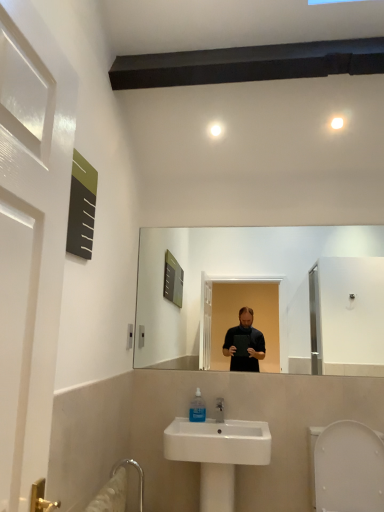
Question: Should I look upward or downward to see white plastic bidet at lower right?

Choices:
 (A) up
 (B) down

Answer: (B)

Question: Is white plastic bidet at lower right touching white ceramic sink at lower center?

Choices:
 (A) yes
 (B) no

Answer: (B)

Question: Is white plastic bidet at lower right at the left side of white ceramic sink at lower center?

Choices:
 (A) yes
 (B) no

Answer: (B)

Question: Is white plastic bidet at lower right not inside white ceramic sink at lower center?

Choices:
 (A) no
 (B) yes

Answer: (B)

Question: Considering the relative sizes of white plastic bidet at lower right and white ceramic sink at lower center in the image provided, is white plastic bidet at lower right taller than white ceramic sink at lower center?

Choices:
 (A) yes
 (B) no

Answer: (B)

Question: Considering the relative sizes of white plastic bidet at lower right and white ceramic sink at lower center in the image provided, is white plastic bidet at lower right wider than white ceramic sink at lower center?

Choices:
 (A) yes
 (B) no

Answer: (A)

Question: From the image's perspective, is white plastic bidet at lower right on white ceramic sink at lower center?

Choices:
 (A) yes
 (B) no

Answer: (A)

Question: Is translucent plastic mouthwash at sink oriented towards white ceramic sink at lower center?

Choices:
 (A) yes
 (B) no

Answer: (A)

Question: Is translucent plastic mouthwash at sink at the left side of white ceramic sink at lower center?

Choices:
 (A) no
 (B) yes

Answer: (B)

Question: Does translucent plastic mouthwash at sink have a lesser width compared to white ceramic sink at lower center?

Choices:
 (A) yes
 (B) no

Answer: (A)

Question: From the image's perspective, would you say translucent plastic mouthwash at sink is shown under white ceramic sink at lower center?

Choices:
 (A) yes
 (B) no

Answer: (B)

Question: From a real-world perspective, is translucent plastic mouthwash at sink beneath white ceramic sink at lower center?

Choices:
 (A) no
 (B) yes

Answer: (A)

Question: Can you confirm if translucent plastic mouthwash at sink is positioned to the right of white ceramic sink at lower center?

Choices:
 (A) no
 (B) yes

Answer: (A)

Question: Is white plastic bidet at lower right shorter than translucent plastic mouthwash at sink?

Choices:
 (A) no
 (B) yes

Answer: (A)